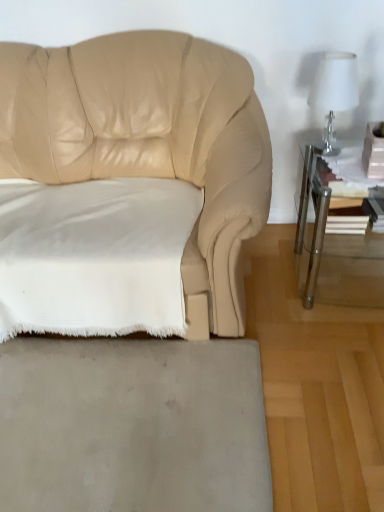
Question: From a real-world perspective, is gray matte rug at lower center located higher than clear glass table at right?

Choices:
 (A) no
 (B) yes

Answer: (A)

Question: Is clear glass table at right at the back of gray matte rug at lower center?

Choices:
 (A) no
 (B) yes

Answer: (A)

Question: Considering the relative sizes of gray matte rug at lower center and clear glass table at right in the image provided, is gray matte rug at lower center bigger than clear glass table at right?

Choices:
 (A) yes
 (B) no

Answer: (B)

Question: From the image's perspective, is gray matte rug at lower center over clear glass table at right?

Choices:
 (A) yes
 (B) no

Answer: (B)

Question: Is gray matte rug at lower center not close to clear glass table at right?

Choices:
 (A) no
 (B) yes

Answer: (A)

Question: Based on their positions, is white soft fabric pillow at lower left located to the left or right of clear glass table at right?

Choices:
 (A) right
 (B) left

Answer: (B)

Question: From a real-world perspective, is white soft fabric pillow at lower left above or below clear glass table at right?

Choices:
 (A) above
 (B) below

Answer: (A)

Question: Looking at their shapes, would you say white soft fabric pillow at lower left is wider or thinner than clear glass table at right?

Choices:
 (A) thin
 (B) wide

Answer: (B)

Question: Considering the positions of white soft fabric pillow at lower left and clear glass table at right in the image, is white soft fabric pillow at lower left taller or shorter than clear glass table at right?

Choices:
 (A) tall
 (B) short

Answer: (B)

Question: In the image, is gray matte rug at lower center on the left side or the right side of white soft fabric pillow at lower left?

Choices:
 (A) right
 (B) left

Answer: (A)

Question: Based on their sizes in the image, would you say gray matte rug at lower center is bigger or smaller than white soft fabric pillow at lower left?

Choices:
 (A) big
 (B) small

Answer: (B)

Question: Looking at their shapes, would you say gray matte rug at lower center is wider or thinner than white soft fabric pillow at lower left?

Choices:
 (A) wide
 (B) thin

Answer: (A)

Question: From a real-world perspective, relative to white soft fabric pillow at lower left, is gray matte rug at lower center vertically above or below?

Choices:
 (A) below
 (B) above

Answer: (A)

Question: From a real-world perspective, relative to gray matte rug at lower center, is white soft fabric pillow at lower left vertically above or below?

Choices:
 (A) below
 (B) above

Answer: (B)

Question: From the image's perspective, is white soft fabric pillow at lower left located above or below gray matte rug at lower center?

Choices:
 (A) above
 (B) below

Answer: (A)